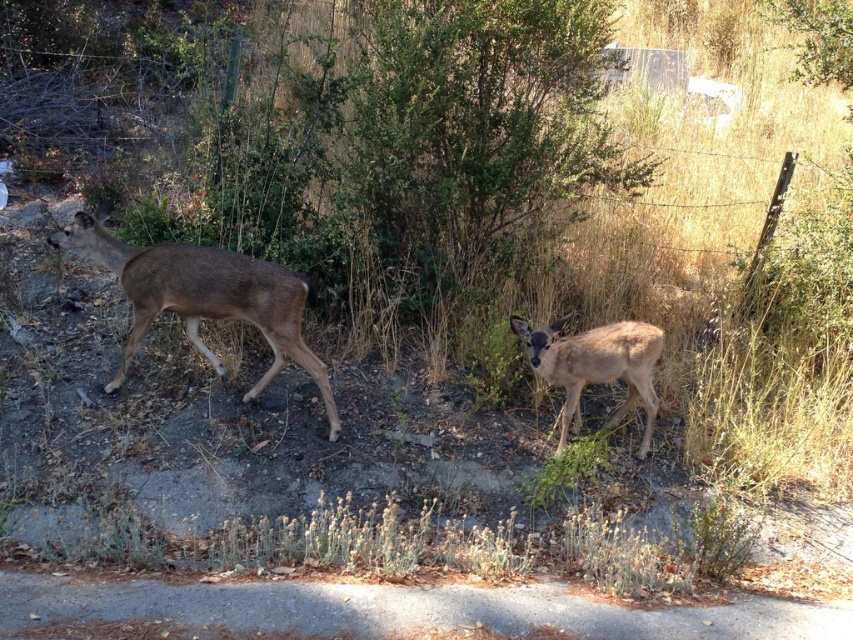
Between brown matte/deer at left and brown matte deer at center, which one has more height?

Standing taller between the two is brown matte/deer at left.

This screenshot has width=853, height=640. What do you see at coordinates (204, 296) in the screenshot?
I see `brown matte/deer at left` at bounding box center [204, 296].

From the picture: Who is more distant from viewer, (68, 230) or (643, 452)?

Positioned behind is point (643, 452).

Locate an element on the screen. brown matte/deer at left is located at coordinates (204, 296).